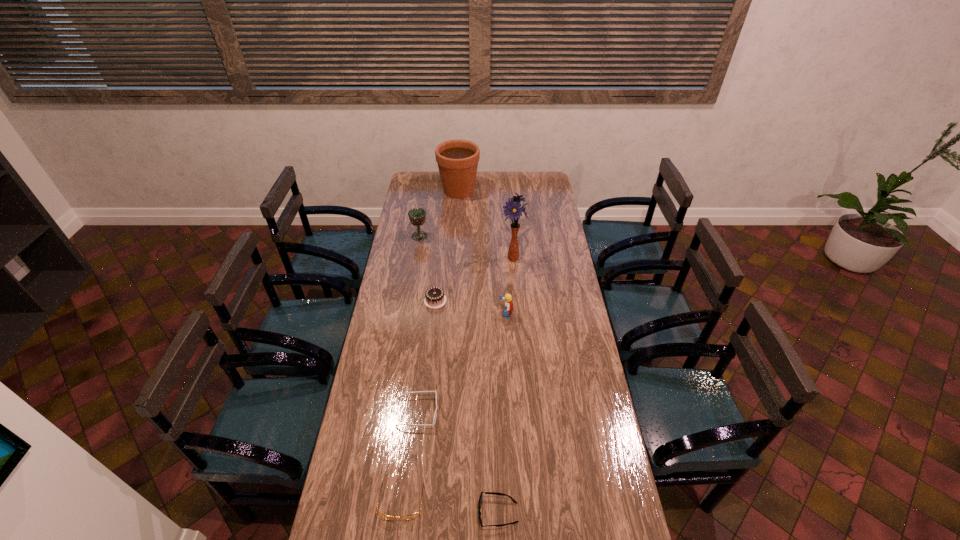
Locate an element on the screen. The height and width of the screenshot is (540, 960). free space located with the lenses of the taller sunglasses facing outward is located at coordinates (505, 412).

What are the coordinates of `vacant space located 0.090m on the front-facing side of the shorter sunglasses` in the screenshot? It's located at (448, 512).

Locate an element on the screen. The image size is (960, 540). vacant region located on the front-facing side of the shorter sunglasses is located at coordinates (422, 512).

Identify the location of free spot located on the front-facing side of the shorter sunglasses. This screenshot has width=960, height=540. (439, 512).

Where is `object that is at the far edge`? The width and height of the screenshot is (960, 540). object that is at the far edge is located at coordinates (457, 160).

This screenshot has width=960, height=540. Find the location of `chalice present at the left edge`. chalice present at the left edge is located at coordinates (417, 216).

Identify the location of sunglasses present at the left edge. The height and width of the screenshot is (540, 960). (434, 419).

I want to click on spectacles at the left edge, so click(x=412, y=516).

The image size is (960, 540). In the image, there is a desktop. Find the location of `vacant space at the far edge`. vacant space at the far edge is located at coordinates (522, 172).

Where is `vacant space at the left edge`? vacant space at the left edge is located at coordinates (420, 231).